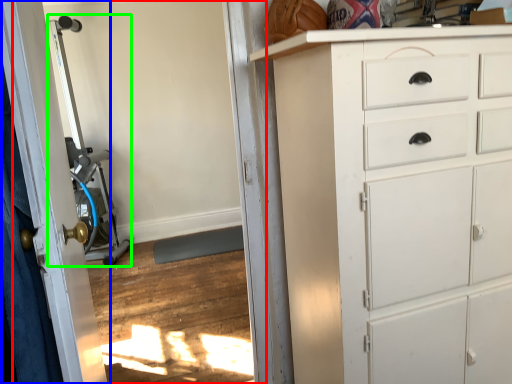
Question: Which object is positioned farthest from screen door (highlighted by a red box)? Select from door (highlighted by a blue box) and sport equipment (highlighted by a green box).

Choices:
 (A) door
 (B) sport equipment

Answer: (B)